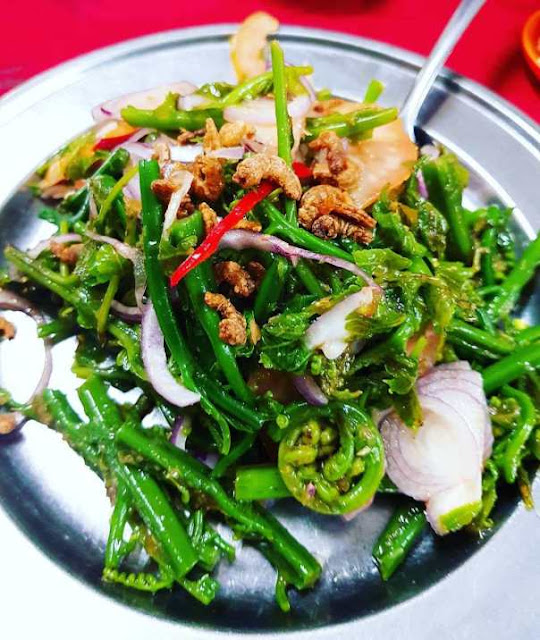
Find the location of a particular element. This screenshot has height=640, width=540. table is located at coordinates (62, 35).